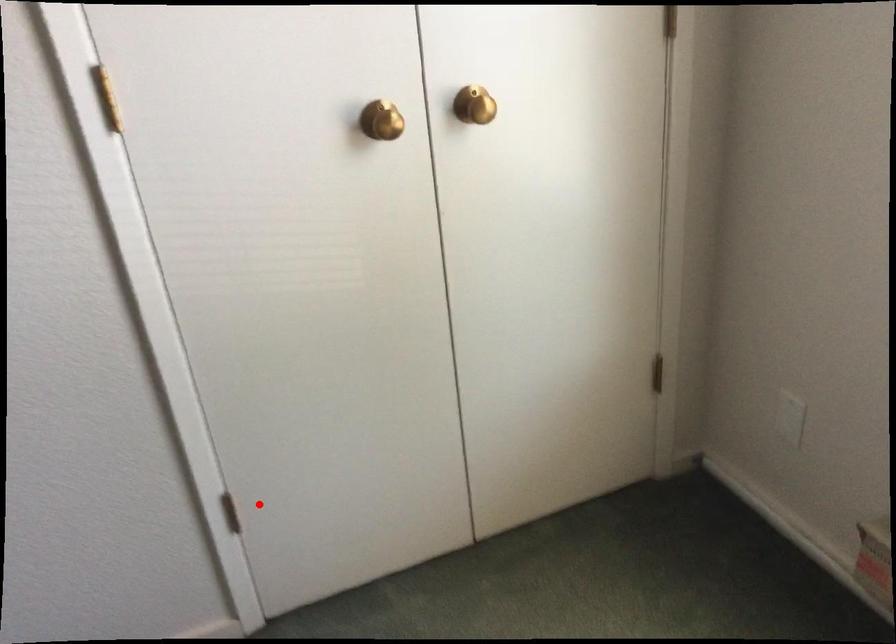
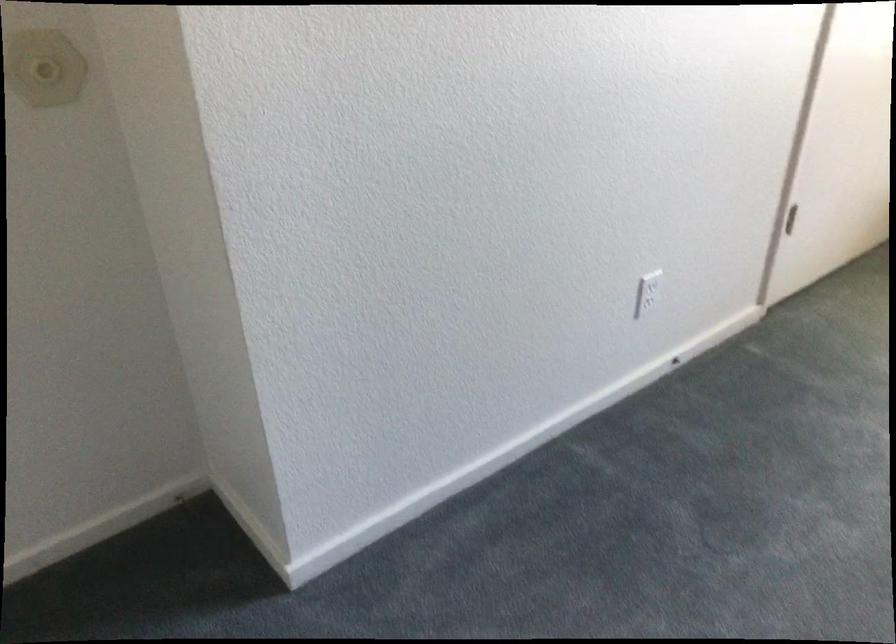
Where in the second image is the point corresponding to the highlighted location from the first image?

(790, 219)